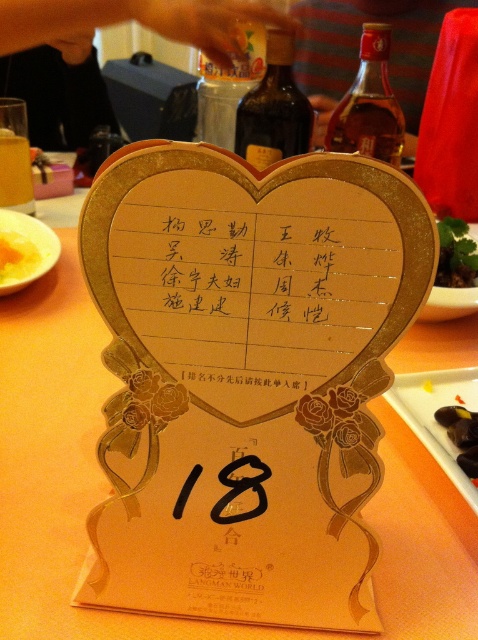
Is yellow matte plate at lower left above yellow soft-boiled egg at center?

Correct, yellow matte plate at lower left is located above yellow soft-boiled egg at center.

Is yellow matte plate at lower left to the right of yellow soft-boiled egg at center from the viewer's perspective?

Yes, yellow matte plate at lower left is to the right of yellow soft-boiled egg at center.

What do you see at coordinates (25, 250) in the screenshot? I see `yellow matte plate at lower left` at bounding box center [25, 250].

This screenshot has width=478, height=640. What are the coordinates of `yellow matte plate at lower left` in the screenshot? It's located at (25, 250).

In the scene shown: Which is more to the right, yellow matte plate at lower left or green leafy vegetable at right?

green leafy vegetable at right is more to the right.

From the picture: Does yellow matte plate at lower left lie behind green leafy vegetable at right?

No, yellow matte plate at lower left is closer to the viewer.

Identify the location of yellow matte plate at lower left. (25, 250).

Find the location of a particular element. This screenshot has width=478, height=640. yellow matte plate at lower left is located at coordinates (25, 250).

Does white plastic tray at lower right appear over yellow matte plate at lower left?

No, white plastic tray at lower right is not above yellow matte plate at lower left.

Which is below, white plastic tray at lower right or yellow matte plate at lower left?

white plastic tray at lower right is lower down.

At what (x,y) coordinates should I click in order to perform the action: click on white plastic tray at lower right. Please return your answer as a coordinate pair (x, y). Looking at the image, I should click on (434, 417).